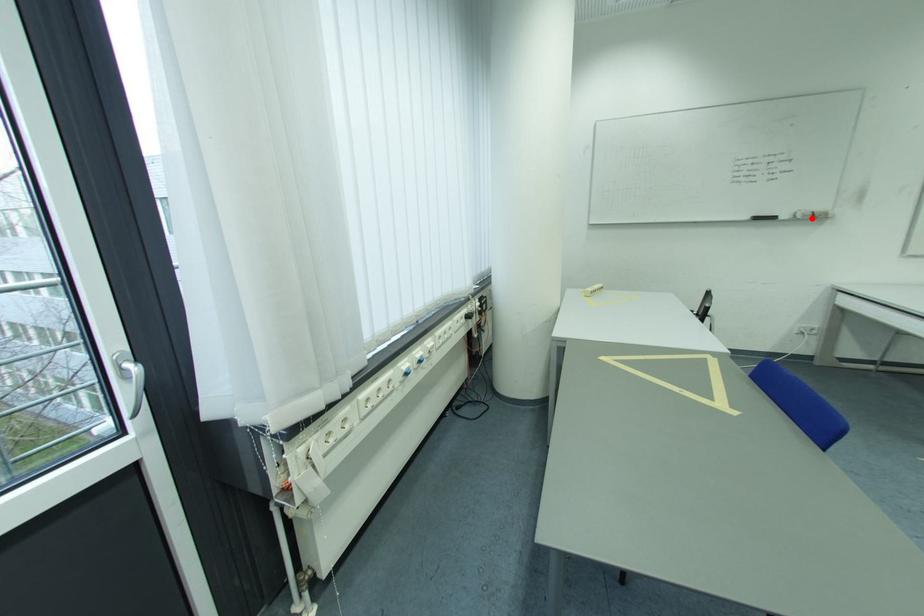
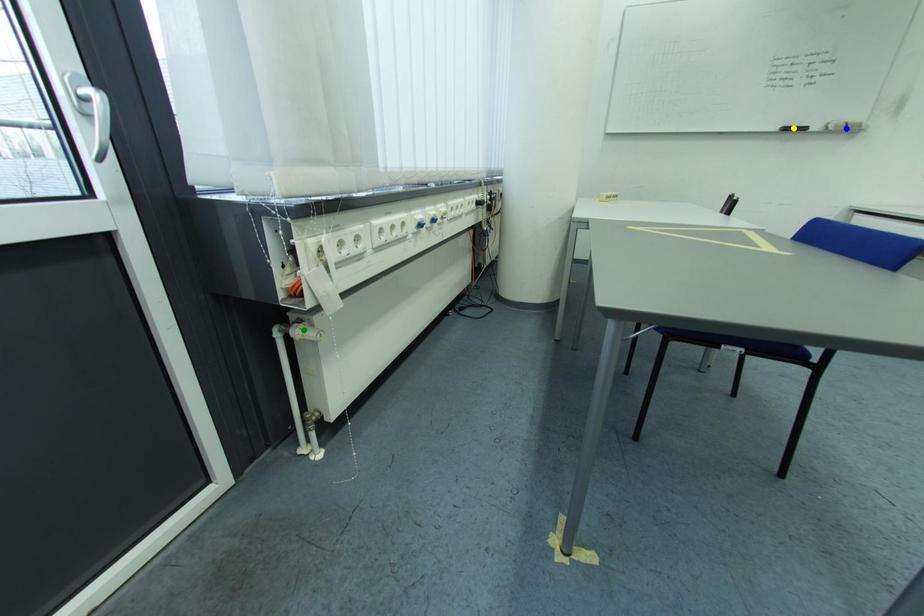
Question: I am providing you with two images of the same scene from different viewpoints. A red point is marked on the first image. You are given multiple points on the second image. Which point in image 2 represents the same 3d spot as the red point in image 1?

Choices:
 (A) green point
 (B) yellow point
 (C) blue point

Answer: (C)